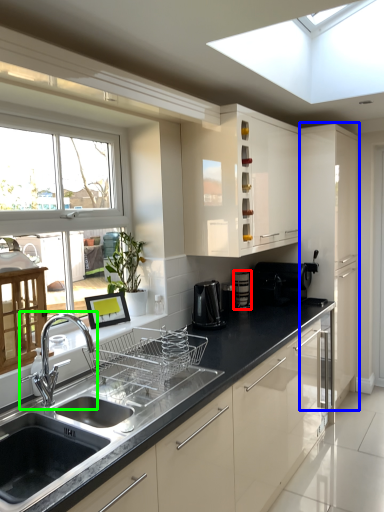
Question: Estimate the real-world distances between objects in this image. Which object is farther from appliance (highlighted by a red box), cabinetry (highlighted by a blue box) or tap (highlighted by a green box)?

Choices:
 (A) cabinetry
 (B) tap

Answer: (B)